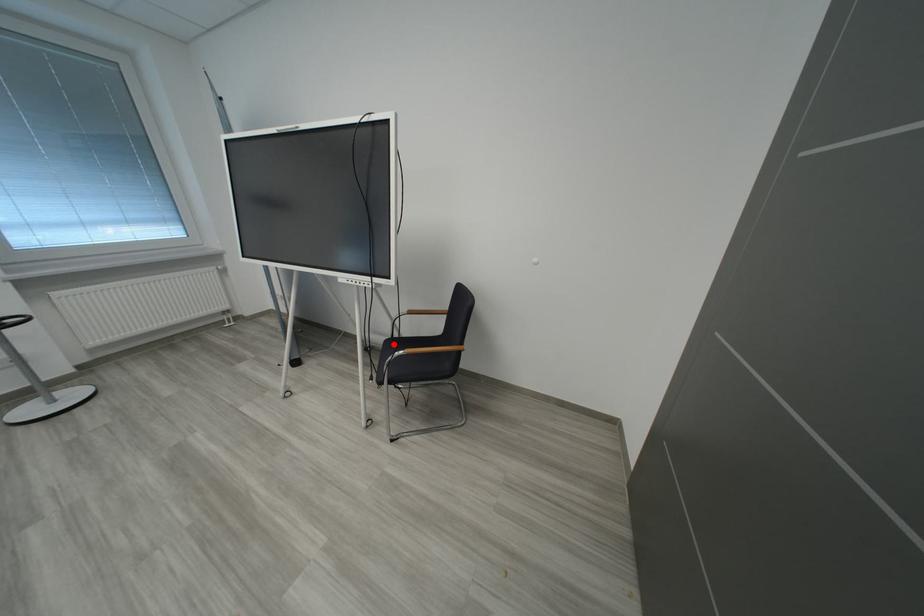
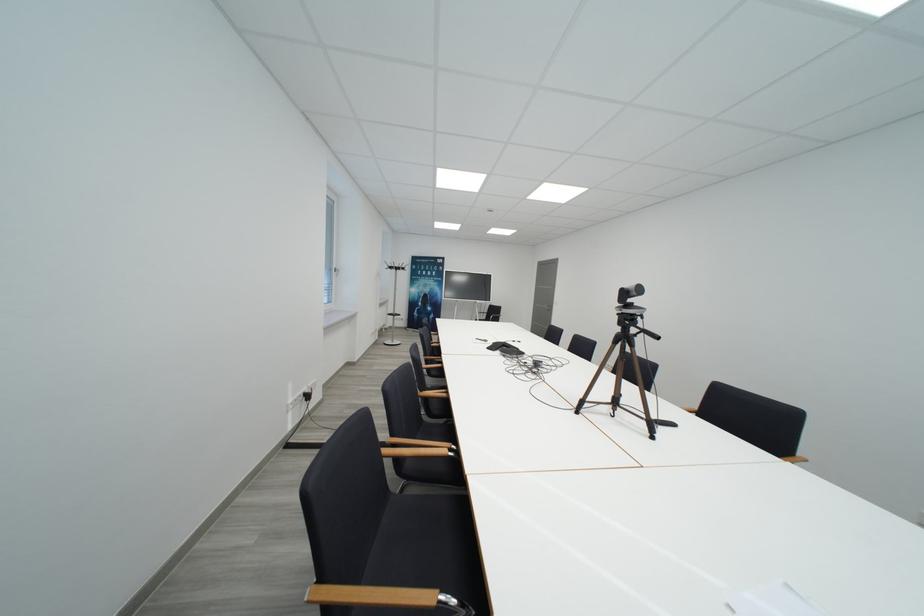
Question: I am providing you with two images of the same scene from different viewpoints. A red point is marked on the first image. Is the red point's position out of view in image 2?

Choices:
 (A) Yes
 (B) No

Answer: (A)